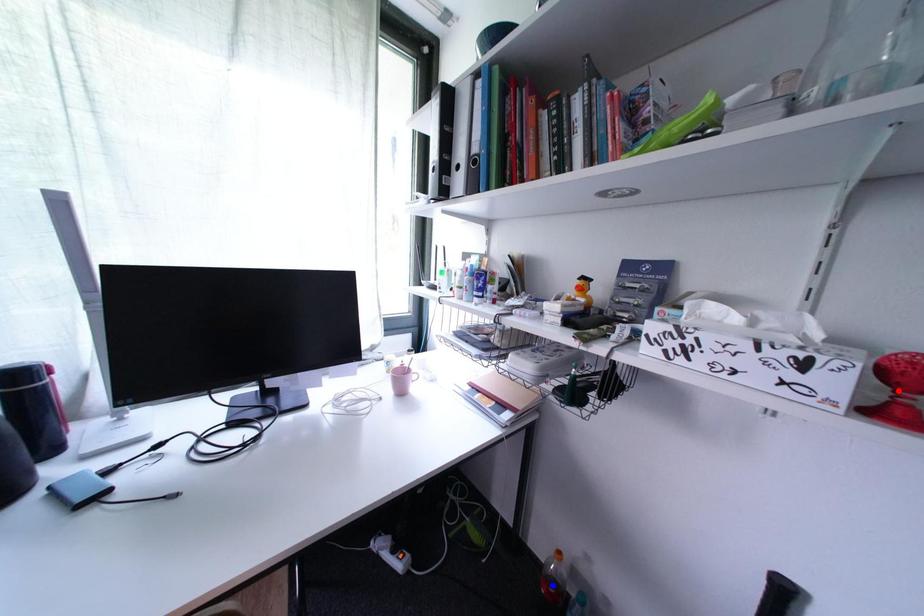
Question: Which of the two points in the image is closer to the camera?

Choices:
 (A) Blue point is closer.
 (B) Red point is closer.

Answer: (B)